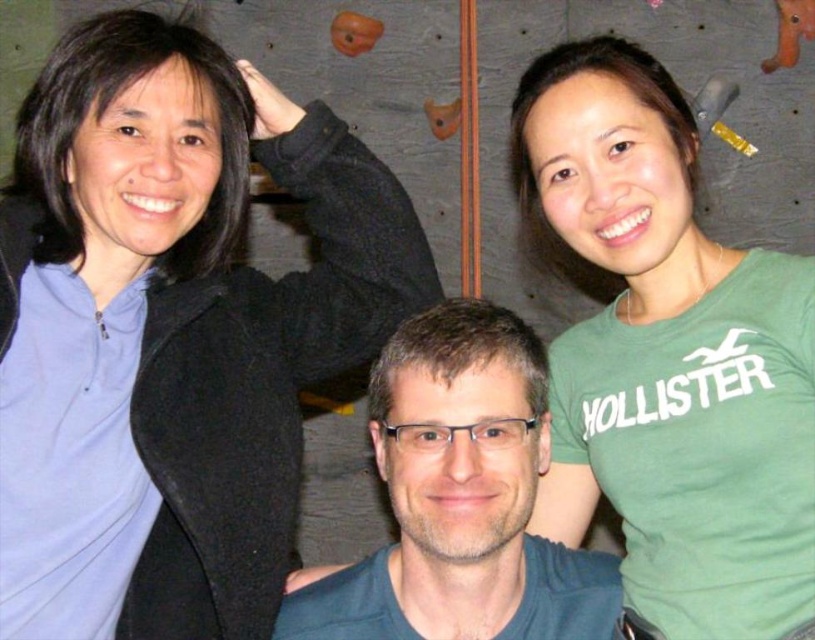
Question: Which object is closer to the camera taking this photo?

Choices:
 (A) dark blue fabric at center
 (B) matte black sweater at upper left
 (C) green cotton t-shirt at upper right

Answer: (A)

Question: In this image, where is green cotton t-shirt at upper right located relative to dark blue fabric at center?

Choices:
 (A) above
 (B) below

Answer: (A)

Question: Is matte black sweater at upper left thinner than green cotton t-shirt at upper right?

Choices:
 (A) yes
 (B) no

Answer: (B)

Question: Is matte black sweater at upper left behind green cotton t-shirt at upper right?

Choices:
 (A) no
 (B) yes

Answer: (A)

Question: Which object is closer to the camera taking this photo?

Choices:
 (A) dark blue fabric at center
 (B) matte black sweater at upper left

Answer: (A)

Question: Which of these objects is positioned closest to the green cotton t-shirt at upper right?

Choices:
 (A) dark blue fabric at center
 (B) matte black sweater at upper left

Answer: (A)